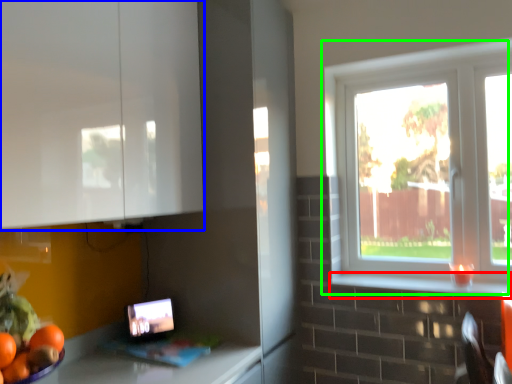
Question: Estimate the real-world distances between objects in this image. Which object is closer to window sill (highlighted by a red box), cabinetry (highlighted by a blue box) or window (highlighted by a green box)?

Choices:
 (A) cabinetry
 (B) window

Answer: (B)